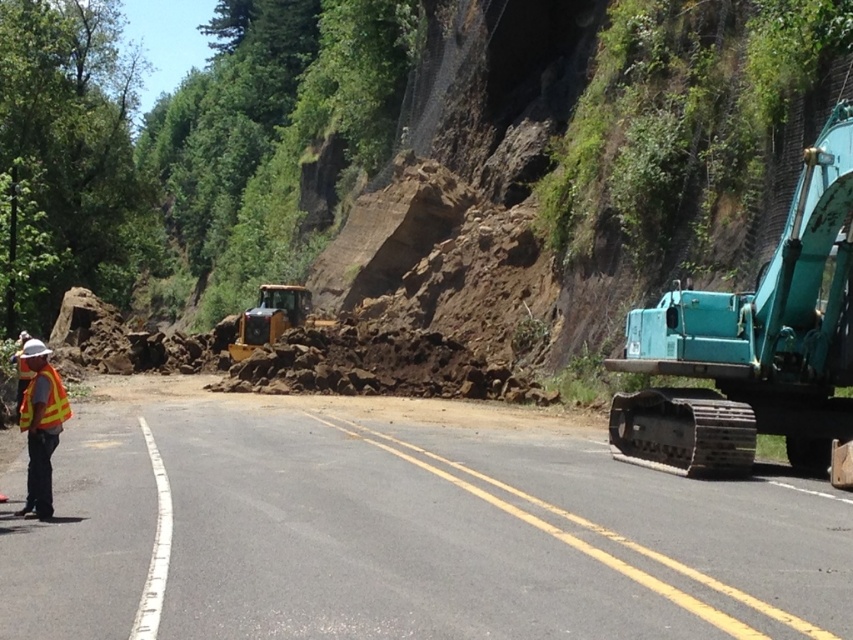
Question: Which of the following is the closest to the observer?

Choices:
 (A) yellow reflective vest at left
 (B) black asphalt road at lower left
 (C) reflective yellow safety vest at left

Answer: (B)

Question: Among these objects, which one is farthest from the camera?

Choices:
 (A) yellow rubber tractor at center
 (B) teal metallic excavator at right

Answer: (A)

Question: Is yellow reflective vest at left smaller than yellow rubber tractor at center?

Choices:
 (A) no
 (B) yes

Answer: (B)

Question: Among these objects, which one is farthest from the camera?

Choices:
 (A) teal metallic excavator at right
 (B) black asphalt road at lower left

Answer: (A)

Question: Does teal metallic excavator at right have a lesser width compared to reflective yellow safety vest at left?

Choices:
 (A) no
 (B) yes

Answer: (A)

Question: Can you confirm if yellow rubber tractor at center is positioned to the right of reflective yellow safety vest at left?

Choices:
 (A) no
 (B) yes

Answer: (A)